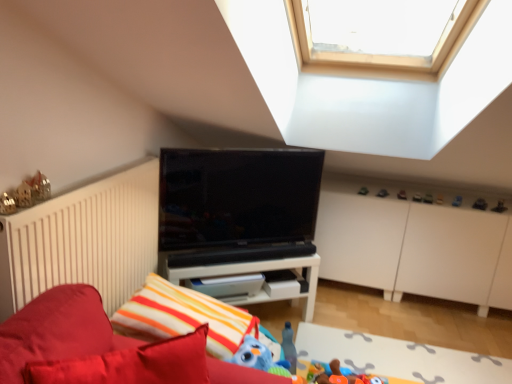
Question: Does white matte shelf at center appear on the left side of blue rubber duck at upper center, placed as the 7th toy when sorted from back to front?

Choices:
 (A) no
 (B) yes

Answer: (B)

Question: Can you confirm if white matte shelf at center is bigger than blue rubber duck at upper center, placed as the 7th toy when sorted from back to front?

Choices:
 (A) no
 (B) yes

Answer: (B)

Question: Is white matte shelf at center positioned behind blue rubber duck at upper center, which ranks as the ninth toy in left-to-right order?

Choices:
 (A) yes
 (B) no

Answer: (B)

Question: Does white matte shelf at center turn towards blue rubber duck at upper center, placed as the 7th toy when sorted from back to front?

Choices:
 (A) no
 (B) yes

Answer: (A)

Question: Considering the relative sizes of white matte shelf at center and blue rubber duck at upper center, which ranks as the ninth toy in left-to-right order, in the image provided, is white matte shelf at center smaller than blue rubber duck at upper center, which ranks as the ninth toy in left-to-right order,?

Choices:
 (A) no
 (B) yes

Answer: (A)

Question: Can you confirm if white matte shelf at center is thinner than blue rubber duck at upper center, placed as the 7th toy when sorted from back to front?

Choices:
 (A) no
 (B) yes

Answer: (A)

Question: Considering the relative sizes of velvet red bed at lower left and white matte dresser at center in the image provided, is velvet red bed at lower left wider than white matte dresser at center?

Choices:
 (A) yes
 (B) no

Answer: (B)

Question: Can white matte dresser at center be found inside velvet red bed at lower left?

Choices:
 (A) yes
 (B) no

Answer: (B)

Question: Is velvet red bed at lower left facing away from white matte dresser at center?

Choices:
 (A) yes
 (B) no

Answer: (B)

Question: Considering the relative sizes of velvet red bed at lower left and white matte dresser at center in the image provided, is velvet red bed at lower left smaller than white matte dresser at center?

Choices:
 (A) no
 (B) yes

Answer: (B)

Question: Is velvet red bed at lower left next to white matte dresser at center and touching it?

Choices:
 (A) no
 (B) yes

Answer: (A)

Question: Is velvet red bed at lower left in front of white matte dresser at center?

Choices:
 (A) yes
 (B) no

Answer: (A)

Question: Does green matte toy at upper right, the third toy in the left-to-right sequence, have a smaller size compared to soft plush toy at lower center, acting as the second toy starting from the front?

Choices:
 (A) no
 (B) yes

Answer: (B)